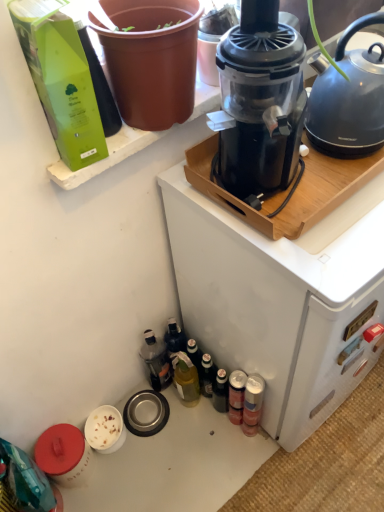
Image resolution: width=384 pixels, height=512 pixels. What are the coordinates of `vacant area that is situated to the right of metallic silver can at lower right, arranged as the first bottle when viewed from the right` in the screenshot? It's located at (311, 450).